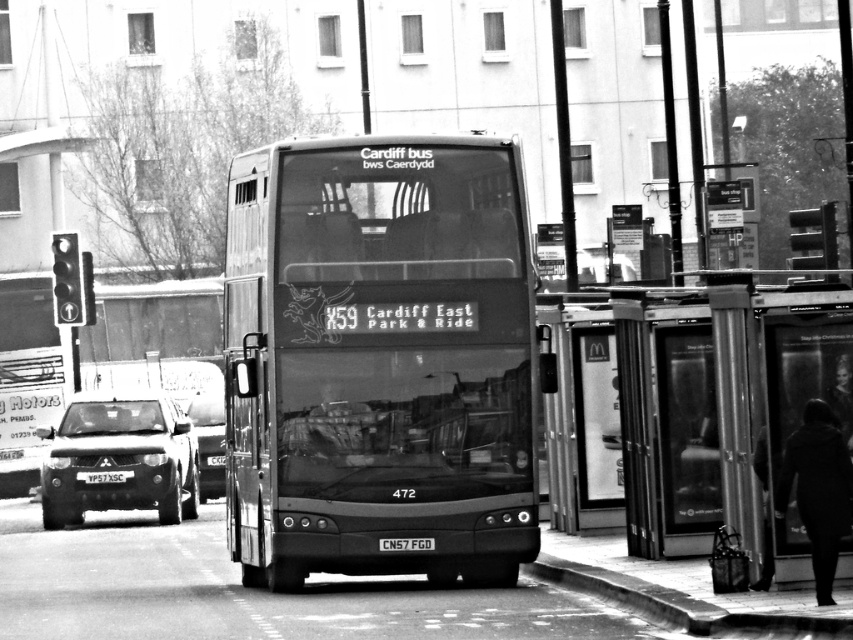
The height and width of the screenshot is (640, 853). What do you see at coordinates (378, 358) in the screenshot? I see `metallic silver bus at center` at bounding box center [378, 358].

This screenshot has height=640, width=853. What do you see at coordinates (378, 358) in the screenshot?
I see `metallic silver bus at center` at bounding box center [378, 358].

Where is `metallic silver bus at center`? The height and width of the screenshot is (640, 853). metallic silver bus at center is located at coordinates (378, 358).

Describe the element at coordinates (378, 358) in the screenshot. I see `metallic silver bus at center` at that location.

Is point (318, 472) positioned before point (183, 477)?

Yes, point (318, 472) is closer to viewer.

Find the location of a particular element. This screenshot has width=853, height=640. metallic silver bus at center is located at coordinates (378, 358).

Between metallic silver bus at center and transparent glass bus stop at right, which one has less height?

With less height is transparent glass bus stop at right.

Can you confirm if metallic silver bus at center is taller than transparent glass bus stop at right?

Yes.

Between point (529, 336) and point (700, 346), which one is positioned behind?

Point (700, 346)

Locate an element on the screen. metallic silver bus at center is located at coordinates (378, 358).